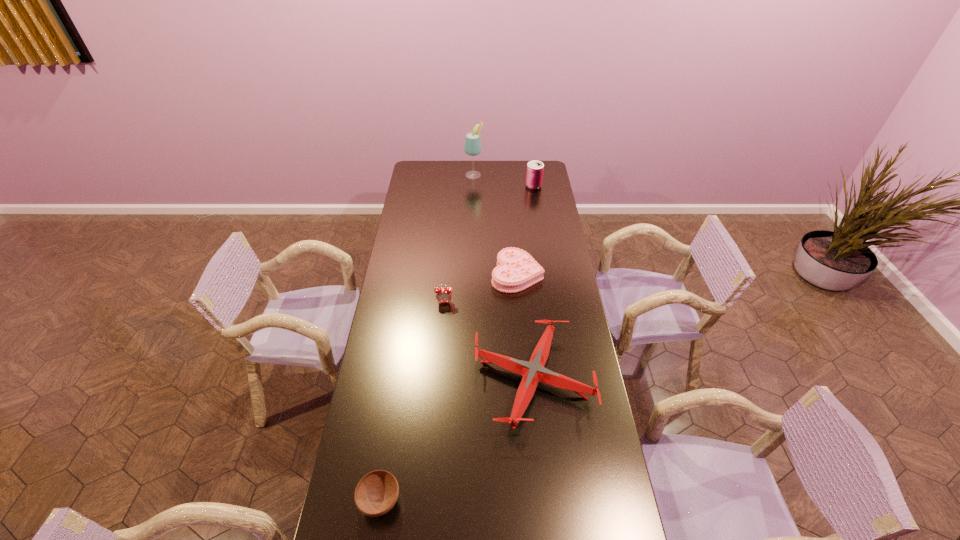
You are a GUI agent. You are given a task and a screenshot of the screen. Output one action in this format:
    pyautogui.click(x=<x>, y=<y>)
    Task: Click on the unoccupied position between the fifth object from right to left and the bowl
    Image resolution: width=960 pixels, height=540 pixels.
    Given the screenshot: What is the action you would take?
    pyautogui.click(x=412, y=401)

In order to click on unoccupied area between the cake and the alcohol in this screenshot , I will do `click(495, 224)`.

You are a GUI agent. You are given a task and a screenshot of the screen. Output one action in this format:
    pyautogui.click(x=<x>, y=<y>)
    Task: Click on the vacant area that lies between the alarm clock and the second tallest object
    The image size is (960, 540).
    Given the screenshot: What is the action you would take?
    pyautogui.click(x=489, y=244)

At what (x,y) coordinates should I click in order to perform the action: click on free space between the fifth farthest object and the leftmost object. Please return your answer as a coordinate pair (x, y). Image resolution: width=960 pixels, height=540 pixels. Looking at the image, I should click on (456, 440).

Identify the location of the third closest object relative to the cake. (534, 176).

Identify which object is the fourth closest to the cake. Please provide its 2D coordinates. Your answer should be formatted as a tuple, i.e. [(x, y)], where the tuple contains the x and y coordinates of a point satisfying the conditions above.

[(472, 146)]

Locate an element on the screen. The width and height of the screenshot is (960, 540). vacant space that satisfies the following two spatial constraints: 1. on the face of the third nearest object; 2. on the left side of the drone is located at coordinates (439, 380).